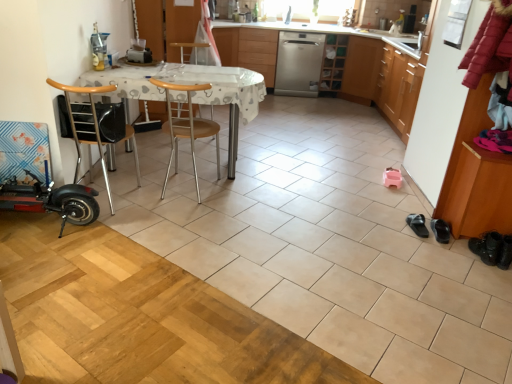
The height and width of the screenshot is (384, 512). In order to click on vacant space underneath black leather shoe at lower right, which is the third footwear from right to left (from a real-world perspective) in this screenshot , I will do `click(414, 228)`.